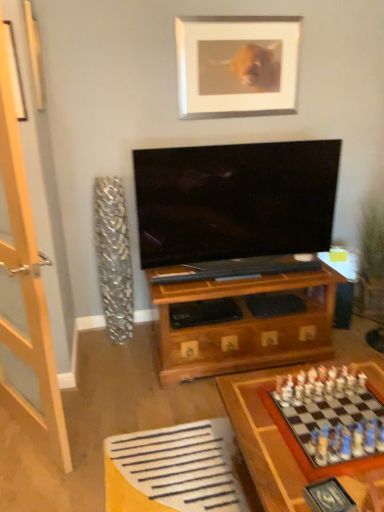
At what (x,y) coordinates should I click in order to perform the action: click on empty space that is ontop of wooden chessboard at lower right (from a real-world perspective). Please return your answer as a coordinate pair (x, y). This screenshot has width=384, height=512. Looking at the image, I should click on (303, 420).